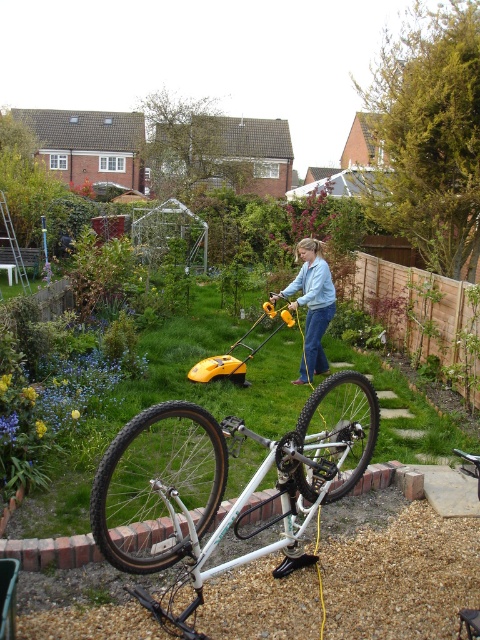
You are standing in the backyard and want to place a small potted plant between the white metallic bicycle at center and the green grass at center. Based on the scene, which object should the potted plant be closer to?

The white metallic bicycle at center is closer to the viewer than the green grass at center, so the potted plant should be placed closer to the green grass at center to maintain the spatial relationship.

In the scene shown: You are standing in the backyard and want to move from the white matte mountain bike at center to the green grass at center. Which direction should you move in?

The green grass at center is to the right of the white matte mountain bike at center, so you should move to the right to reach it.

Consider the image. You are planning to move the white metallic bicycle at center to a new location. The area where you want to place it has a space that is exactly the width of the green grass at center. Will the bicycle fit in that space?

→ The white metallic bicycle at center might be wider than green grass at center, so there is a possibility that it may not fit in the space.